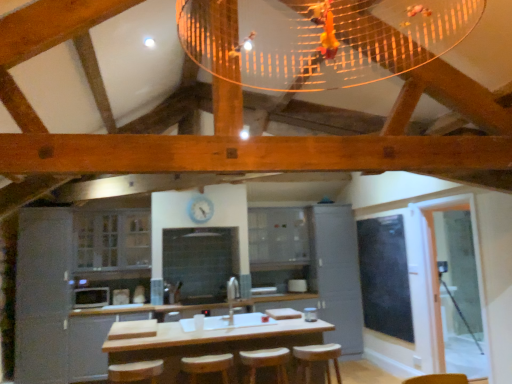
Question: Considering the relative positions of black glass window screen at right and matte gray cabinet at center, the fourth cabinetry from the left, in the image provided, is black glass window screen at right to the left of matte gray cabinet at center, the fourth cabinetry from the left, from the viewer's perspective?

Choices:
 (A) yes
 (B) no

Answer: (B)

Question: From a real-world perspective, is black glass window screen at right positioned over matte gray cabinet at center, the fourth cabinetry from the left, based on gravity?

Choices:
 (A) no
 (B) yes

Answer: (B)

Question: From a real-world perspective, is black glass window screen at right positioned under matte gray cabinet at center, the fourth cabinetry from the left, based on gravity?

Choices:
 (A) yes
 (B) no

Answer: (B)

Question: Is the depth of black glass window screen at right greater than that of matte gray cabinet at center, arranged as the 1th cabinetry when viewed from the right?

Choices:
 (A) no
 (B) yes

Answer: (A)

Question: Is the surface of black glass window screen at right in direct contact with matte gray cabinet at center, arranged as the 1th cabinetry when viewed from the right?

Choices:
 (A) no
 (B) yes

Answer: (A)

Question: Which is correct: black glass window screen at right is inside satin grey cabinet at left, positioned as the 1th cabinetry in left-to-right order, or outside of it?

Choices:
 (A) outside
 (B) inside

Answer: (A)

Question: From the image's perspective, is black glass window screen at right positioned above or below satin grey cabinet at left, positioned as the 1th cabinetry in left-to-right order?

Choices:
 (A) above
 (B) below

Answer: (A)

Question: In terms of height, does black glass window screen at right look taller or shorter compared to satin grey cabinet at left, the 4th cabinetry viewed from the right?

Choices:
 (A) tall
 (B) short

Answer: (B)

Question: In terms of width, does black glass window screen at right look wider or thinner when compared to satin grey cabinet at left, the 4th cabinetry viewed from the right?

Choices:
 (A) wide
 (B) thin

Answer: (B)

Question: Do you think clear glass cabinets at center, the second cabinetry when ordered from left to right, is within clear glass screen door at right, or outside of it?

Choices:
 (A) inside
 (B) outside

Answer: (B)

Question: Is clear glass cabinets at center, the second cabinetry when ordered from left to right, in front of or behind clear glass screen door at right in the image?

Choices:
 (A) behind
 (B) front

Answer: (A)

Question: Considering the relative positions of clear glass cabinets at center, the second cabinetry when ordered from left to right, and clear glass screen door at right in the image provided, is clear glass cabinets at center, the second cabinetry when ordered from left to right, to the left or to the right of clear glass screen door at right?

Choices:
 (A) right
 (B) left

Answer: (B)

Question: In terms of size, does clear glass cabinets at center, acting as the 3th cabinetry starting from the right, appear bigger or smaller than clear glass screen door at right?

Choices:
 (A) small
 (B) big

Answer: (B)

Question: From a real-world perspective, is white glossy microwave at lower left physically located above or below wooden bar stool at center, acting as the second bar stool starting from the right?

Choices:
 (A) below
 (B) above

Answer: (B)

Question: Is white glossy microwave at lower left to the left or to the right of wooden bar stool at center, the second bar stool viewed from the left, in the image?

Choices:
 (A) right
 (B) left

Answer: (B)